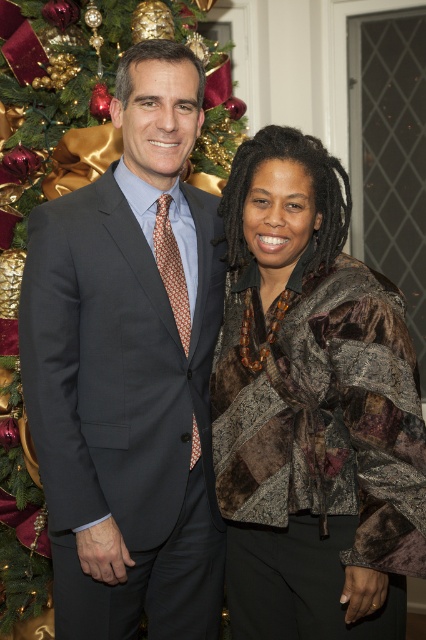
You are standing in front of the Christmas tree and want to place a decoration between the two points, point (117,417) and point (293,529). Which point should you start closer to the camera to position the decoration?

You should start closer to point (117,417) because it is closer to the camera than point (293,529).

From the picture: You are standing in front of the Christmas tree and want to take a photo of the point at coordinates point (x=203, y=584). If your camera has a focal length of 50mm and you are currently 2 meters away from the point, should you move closer or farther away to focus properly?

The point (x=203, y=584) is 1.72 meters from the camera. Since you are currently 2 meters away, you should move closer to 1.72 meters to focus properly.